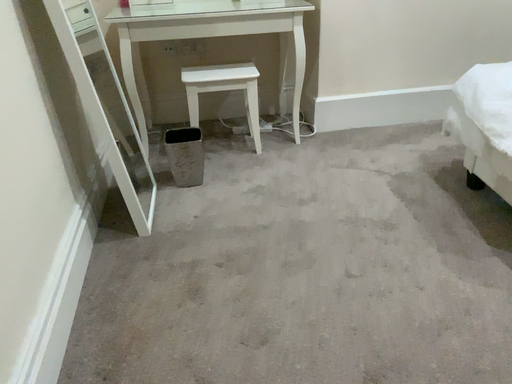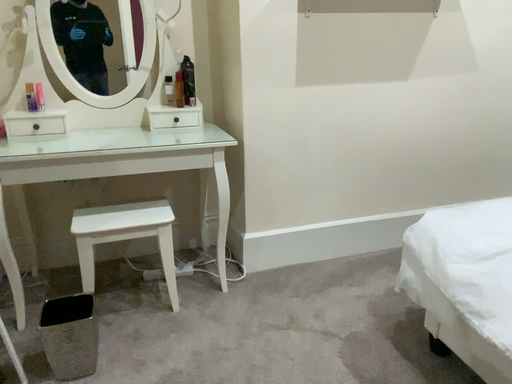
Question: How did the camera likely rotate when shooting the video?

Choices:
 (A) rotated left
 (B) rotated right

Answer: (B)